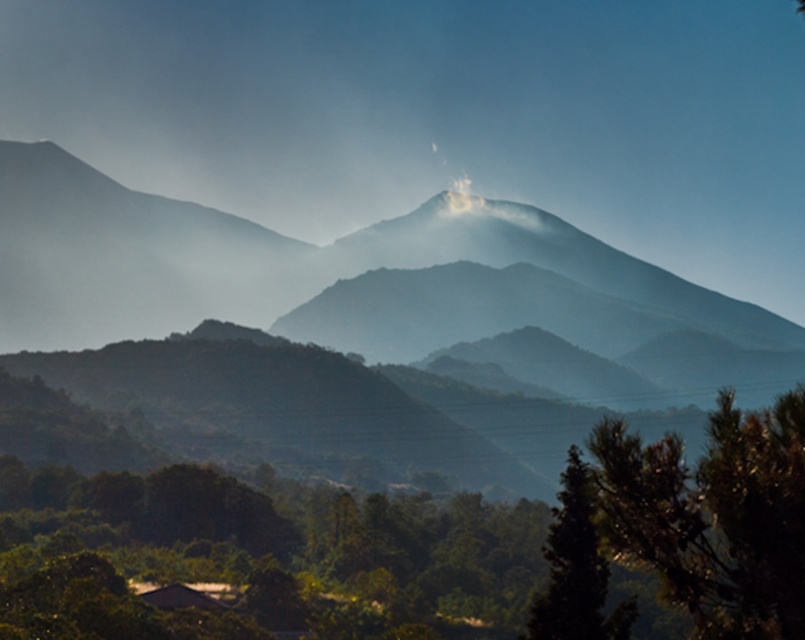
Is green leafy tree at center to the left of green matte tree at lower right from the viewer's perspective?

Correct, you'll find green leafy tree at center to the left of green matte tree at lower right.

Is point (153, 579) farther from camera compared to point (568, 460)?

Yes, it is behind point (568, 460).

The height and width of the screenshot is (640, 805). Identify the location of green leafy tree at center. (423, 547).

Identify the location of green leafy tree at center. The width and height of the screenshot is (805, 640). (423, 547).

Between point (168, 465) and point (770, 522), which one is positioned behind?

The point (168, 465) is behind.

Is point (799, 609) in front of point (667, 586)?

That is True.

Which is behind, point (754, 604) or point (737, 604)?

The point (737, 604) is more distant.

What are the coordinates of `green leafy tree at center` in the screenshot? It's located at (423, 547).

Between smokey gray mountain range at center and green matte tree at lower right, which one appears on the left side from the viewer's perspective?

Positioned to the left is smokey gray mountain range at center.

Is smokey gray mountain range at center taller than green matte tree at lower right?

Indeed, smokey gray mountain range at center has a greater height compared to green matte tree at lower right.

This screenshot has height=640, width=805. Describe the element at coordinates (320, 272) in the screenshot. I see `smokey gray mountain range at center` at that location.

Find the location of a particular element. smokey gray mountain range at center is located at coordinates (320, 272).